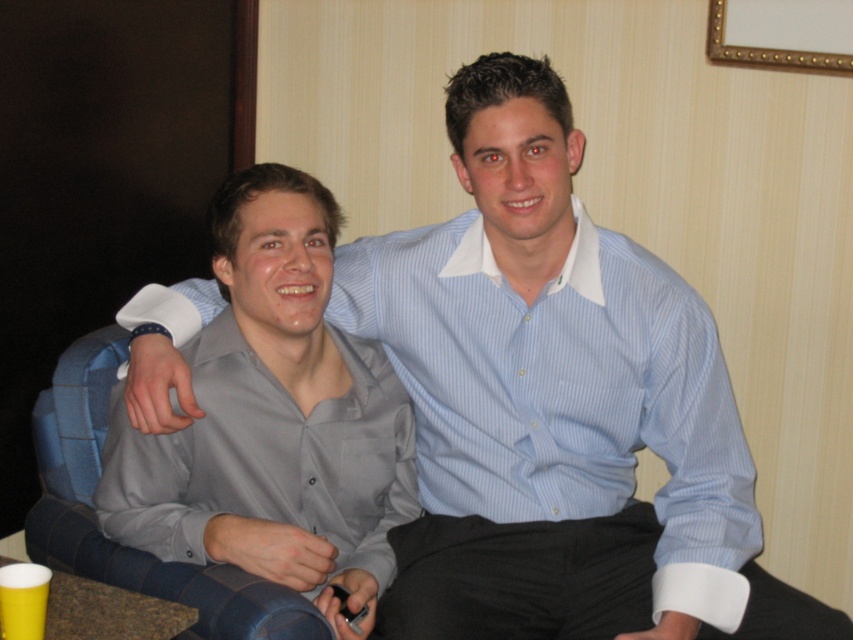
You are a photographer adjusting your camera to focus on the matte gray shirt at center and the gold metallic picture frame at upper right. Which object should you focus on first if you want to capture both clearly in the same shot?

The matte gray shirt at center is in front of the gold metallic picture frame at upper right, so you should focus on the matte gray shirt at center first to ensure both are in focus.

You are standing in the room and want to hand a gift to the person wearing the matte gray shirt at center. Based on their position, which direction should you approach from?

The matte gray shirt at center is located at point coordinates, so you should approach from the front as they are centrally positioned in the room.